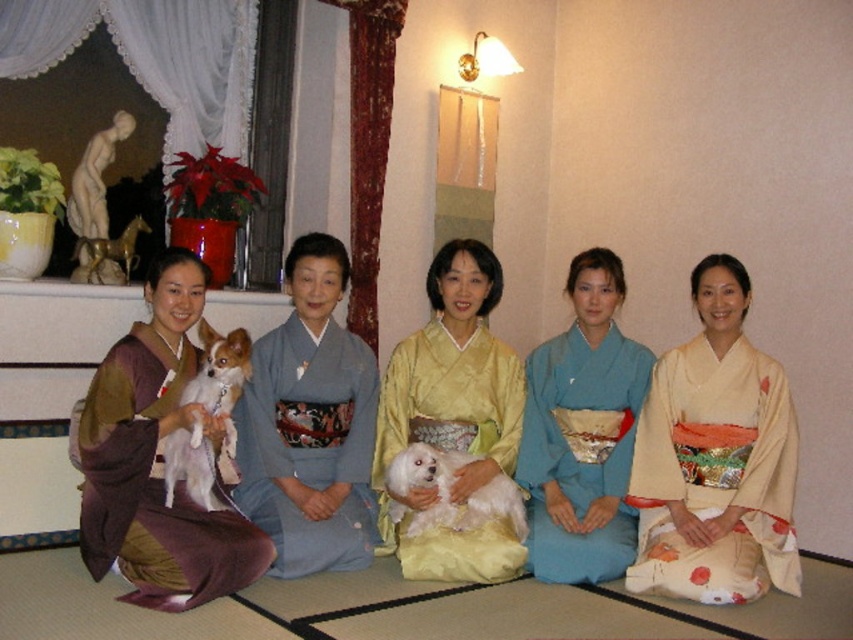
Which of these two, white silk kimono at center or white fluffy dog at left, stands shorter?

Standing shorter between the two is white fluffy dog at left.

The image size is (853, 640). Describe the element at coordinates (715, 458) in the screenshot. I see `white silk kimono at center` at that location.

The image size is (853, 640). What are the coordinates of `white silk kimono at center` in the screenshot? It's located at (715, 458).

Which of these two, white silk kimono at center or blue silk kimono at center, stands shorter?

A: With less height is blue silk kimono at center.

In the scene shown: Can you confirm if white silk kimono at center is bigger than blue silk kimono at center?

Correct, white silk kimono at center is larger in size than blue silk kimono at center.

Measure the distance between point (703, 394) and camera.

Point (703, 394) is 11.95 feet from camera.

Image resolution: width=853 pixels, height=640 pixels. I want to click on white silk kimono at center, so click(715, 458).

Can you confirm if matte brown kimono at left is positioned below yellow silk kimono at center?

Indeed, matte brown kimono at left is positioned under yellow silk kimono at center.

Measure the distance between point (149,493) and camera.

Point (149,493) and camera are 3.19 meters apart.

Locate an element on the screen. The image size is (853, 640). matte brown kimono at left is located at coordinates (157, 460).